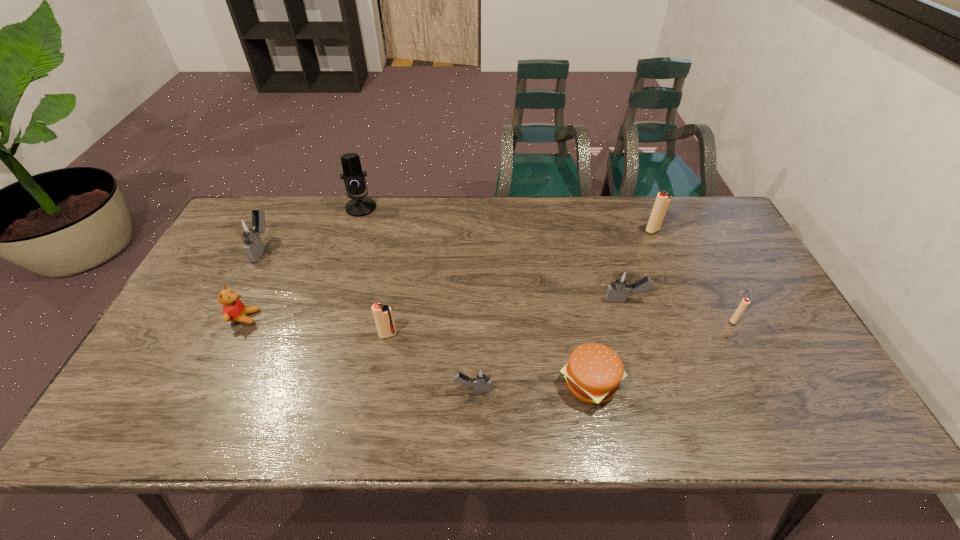
Find the location of `the closest red igniter to the black microphone`. the closest red igniter to the black microphone is located at coordinates (383, 317).

Identify which red igniter is the second closest to the rightmost red igniter. Please provide its 2D coordinates. Your answer should be formatted as a tuple, i.e. [(x, y)], where the tuple contains the x and y coordinates of a point satisfying the conditions above.

[(383, 317)]

The height and width of the screenshot is (540, 960). What are the coordinates of `the closest gray igniter relative to the second farthest gray igniter` in the screenshot? It's located at (481, 378).

The image size is (960, 540). What are the coordinates of `gray igniter that stands as the closest to the farthest object` in the screenshot? It's located at (249, 229).

The height and width of the screenshot is (540, 960). Identify the location of vacant area that satisfies the following two spatial constraints: 1. on the front side of the biggest gray igniter; 2. on the right side of the fifth igniter from right to left. (218, 335).

Image resolution: width=960 pixels, height=540 pixels. Find the location of `vacant space that satisfies the following two spatial constraints: 1. on the stand of the microphone; 2. on the right side of the second nearest igniter`. vacant space that satisfies the following two spatial constraints: 1. on the stand of the microphone; 2. on the right side of the second nearest igniter is located at coordinates (322, 335).

Find the location of `vacant space that satisfies the following two spatial constraints: 1. on the back side of the smallest red igniter; 2. on the right side of the sixth object from left to right`. vacant space that satisfies the following two spatial constraints: 1. on the back side of the smallest red igniter; 2. on the right side of the sixth object from left to right is located at coordinates click(578, 320).

At what (x,y) coordinates should I click in order to perform the action: click on vacant space that satisfies the following two spatial constraints: 1. on the front-facing side of the second igniter from left to right; 2. on the left side of the teddy bear. Please return your answer as a coordinate pair (x, y). This screenshot has height=540, width=960. Looking at the image, I should click on (236, 335).